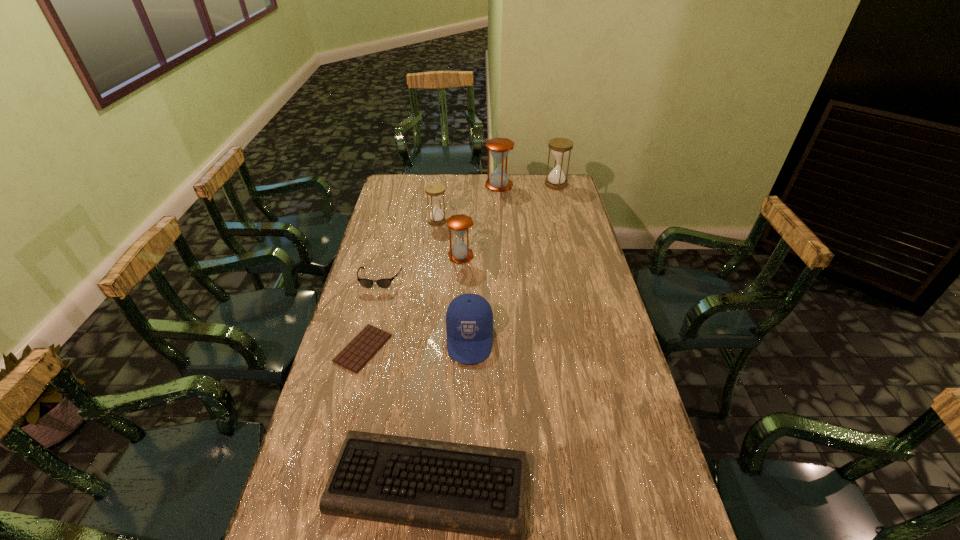
The height and width of the screenshot is (540, 960). Identify the location of the right brown hourglass. (499, 147).

Where is `the second hourglass from right to left`? the second hourglass from right to left is located at coordinates (499, 147).

Where is `the right white hourglass`? The image size is (960, 540). the right white hourglass is located at coordinates (560, 147).

Where is `the rightmost object`? the rightmost object is located at coordinates (560, 147).

Where is `the leftmost hourglass`? the leftmost hourglass is located at coordinates (436, 217).

Where is `the nearer white hourglass`? Image resolution: width=960 pixels, height=540 pixels. the nearer white hourglass is located at coordinates (436, 217).

Where is `the smaller brown hourglass`? the smaller brown hourglass is located at coordinates (459, 224).

Find the location of a particular element. Image resolution: width=960 pixels, height=540 pixels. the second hourglass from left to right is located at coordinates (459, 224).

Find the location of a particular element. blue cap is located at coordinates (469, 318).

This screenshot has width=960, height=540. Identify the location of the fifth tallest object. click(x=469, y=318).